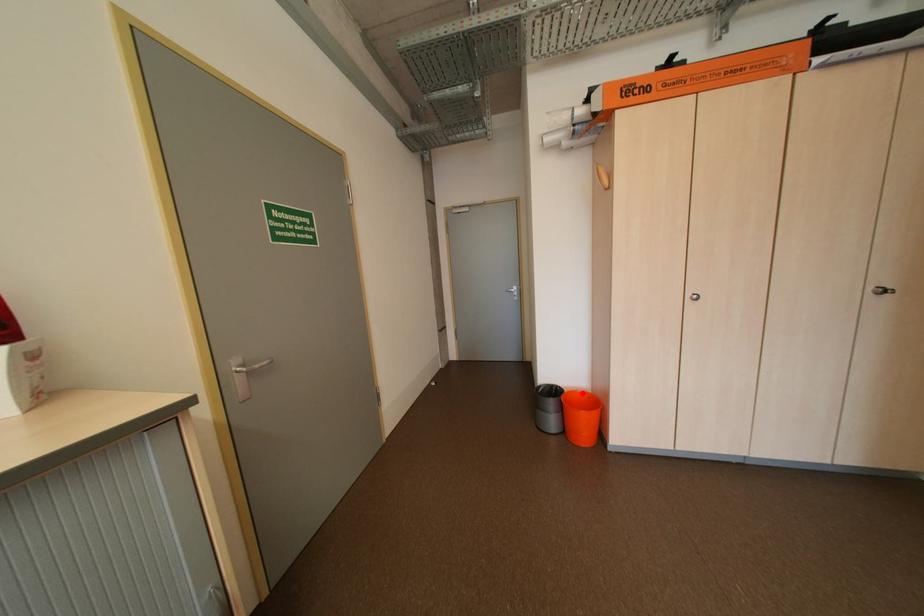
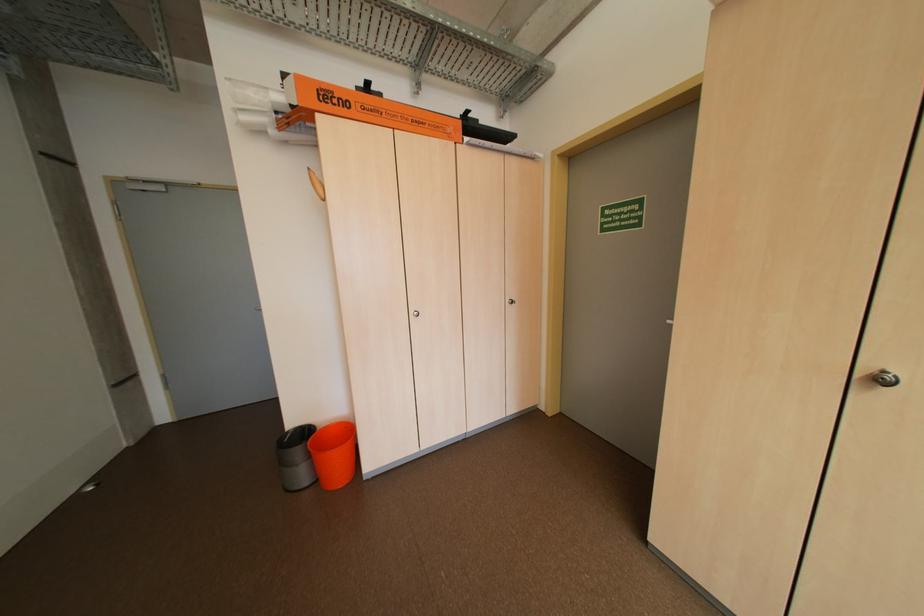
Question: I am providing you with two images of the same scene from different viewpoints. Given a red point in image1, look at the same physical point in image2. Is it:

Choices:
 (A) Closer to the viewpoint
 (B) Farther from the viewpoint

Answer: (A)